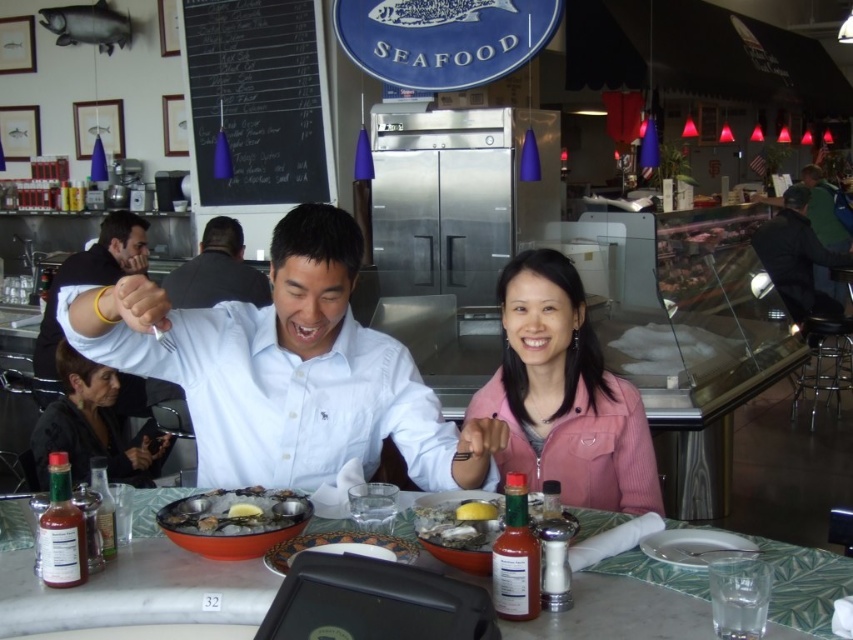
You are a waiter in the restaurant. You need to place a new menu on the table between the light blue shirt at center and the shiny silver oysters at center. Where should you place the menu?

The light blue shirt at center is to the left of the shiny silver oysters at center, so you should place the menu between them to the right of the light blue shirt at center and to the left of the shiny silver oysters at center.

You are a restaurant employee who needs to fold the pink fabric jacket at center and the dark green jacket at upper right. Which jacket will require a smaller storage space due to its size?

The pink fabric jacket at center has a smaller width than the dark green jacket at upper right, so it will require less storage space.